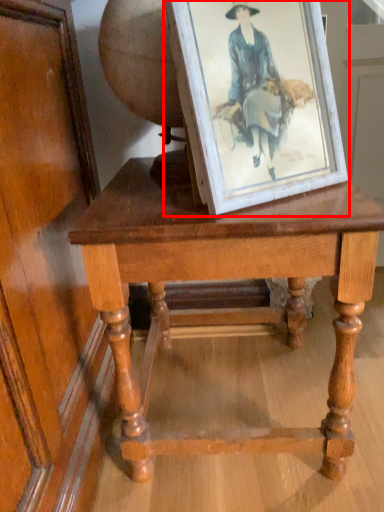
Question: From the image, what is the correct spatial relationship of picture frame (annotated by the red box) in relation to table?

Choices:
 (A) right
 (B) left

Answer: (A)